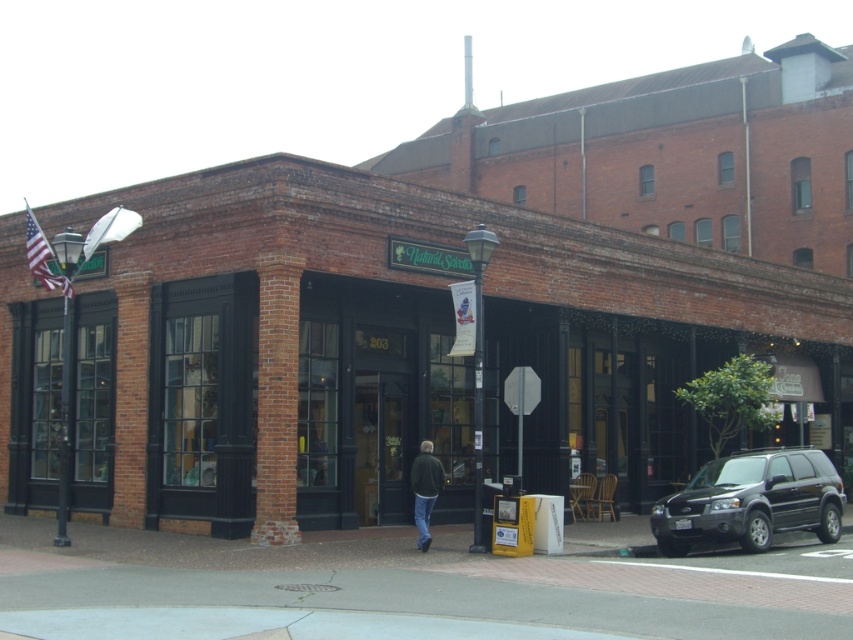
Question: Does smooth concrete sidewalk at center have a lesser width compared to dark green jacket at center?

Choices:
 (A) yes
 (B) no

Answer: (B)

Question: Is smooth concrete sidewalk at center above dark green jacket at center?

Choices:
 (A) no
 (B) yes

Answer: (A)

Question: Does smooth concrete sidewalk at center appear on the right side of black matte suv at lower right?

Choices:
 (A) no
 (B) yes

Answer: (A)

Question: Which of the following is the farthest from the observer?

Choices:
 (A) click(x=235, y=625)
 (B) click(x=804, y=476)
 (C) click(x=529, y=308)

Answer: (C)

Question: Which of the following is the closest to the observer?

Choices:
 (A) black matte suv at lower right
 (B) brick storefront at center
 (C) dark green jacket at center

Answer: (C)

Question: Considering the real-world distances, which object is closest to the brick storefront at center?

Choices:
 (A) dark green jacket at center
 (B) smooth concrete sidewalk at center

Answer: (B)